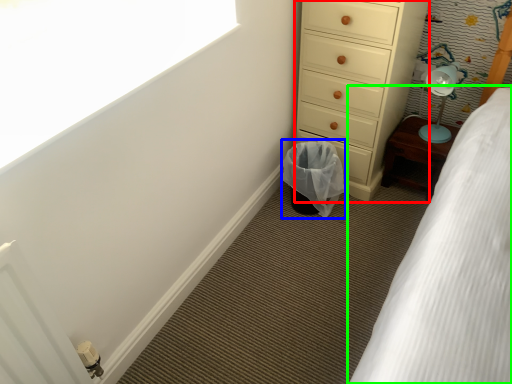
Question: Which object is positioned farthest from chest of drawers (highlighted by a red box)? Select from laundry basket (highlighted by a blue box) and bed (highlighted by a green box).

Choices:
 (A) laundry basket
 (B) bed

Answer: (B)